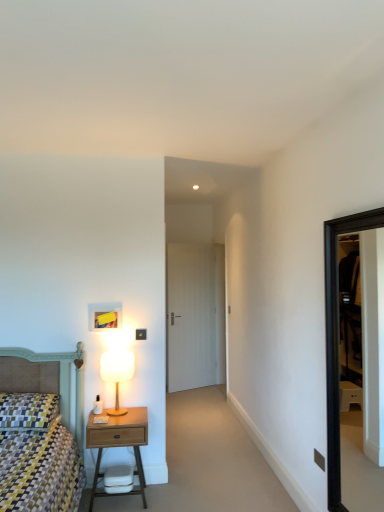
Question: Is black frame door at right situated inside wooden nightstand at lower left or outside?

Choices:
 (A) outside
 (B) inside

Answer: (A)

Question: From the image's perspective, is black frame door at right located above or below wooden nightstand at lower left?

Choices:
 (A) below
 (B) above

Answer: (B)

Question: Estimate the real-world distances between objects in this image. Which object is farther from the black frame door at right?

Choices:
 (A) matte black switch at upper center
 (B) white wood door at center
 (C) patterned fabric pillow at lower left
 (D) matte white lamp at left
 (E) wooden nightstand at lower left

Answer: (B)

Question: Which object is positioned closest to the matte black switch at upper center?

Choices:
 (A) wooden nightstand at lower left
 (B) black frame door at right
 (C) matte white lamp at left
 (D) white wood door at center
 (E) patterned fabric pillow at lower left

Answer: (B)